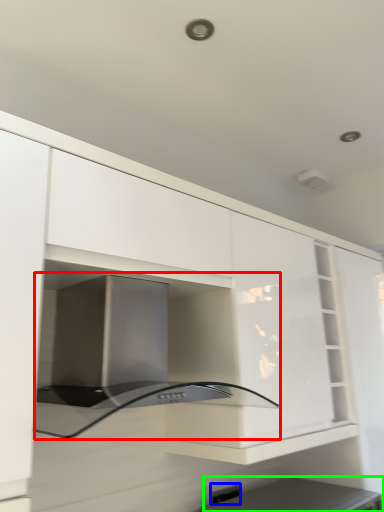
Question: Based on their relative distances, which object is farther from oven (highlighted by a red box)? Choose from electric outlet (highlighted by a blue box) and appliance (highlighted by a green box).

Choices:
 (A) electric outlet
 (B) appliance

Answer: (A)